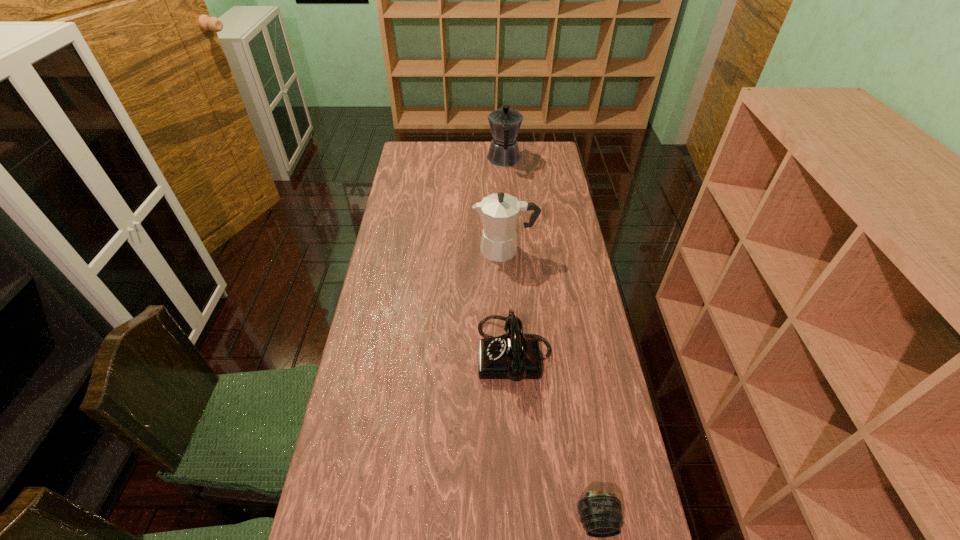
I want to click on free space between the telephone and the second farthest object, so click(510, 302).

Identify the location of free area in between the farthest object and the telephoto lens. The image size is (960, 540). (550, 340).

Where is `free space between the nearest object and the farthest object`? The height and width of the screenshot is (540, 960). free space between the nearest object and the farthest object is located at coordinates (550, 340).

At what (x,y) coordinates should I click in order to perform the action: click on free space between the farthest object and the rightmost object. Please return your answer as a coordinate pair (x, y). This screenshot has width=960, height=540. Looking at the image, I should click on (550, 340).

Locate an element on the screen. free spot between the rightmost object and the third tallest object is located at coordinates (556, 437).

At what (x,y) coordinates should I click in order to perform the action: click on unoccupied position between the second farthest object and the telephone. Please return your answer as a coordinate pair (x, y). Image resolution: width=960 pixels, height=540 pixels. Looking at the image, I should click on (510, 302).

Image resolution: width=960 pixels, height=540 pixels. What are the coordinates of `vacant area that lies between the rightmost object and the third nearest object` in the screenshot? It's located at (551, 385).

In order to click on free area in between the telephone and the third nearest object in this screenshot , I will do `click(510, 302)`.

Find the location of a particular element. free space between the second nearest object and the telephoto lens is located at coordinates (556, 437).

Identify which object is located as the second nearest to the farther coffeepot. Please provide its 2D coordinates. Your answer should be formatted as a tuple, i.e. [(x, y)], where the tuple contains the x and y coordinates of a point satisfying the conditions above.

[(513, 356)]